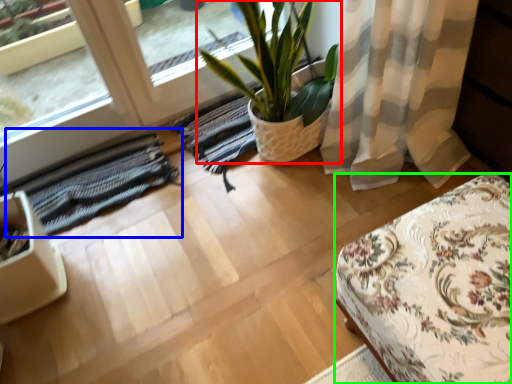
Question: Considering the real-world distances, which object is closest to houseplant (highlighted by a red box)? mat (highlighted by a blue box) or furniture (highlighted by a green box).

Choices:
 (A) mat
 (B) furniture

Answer: (A)